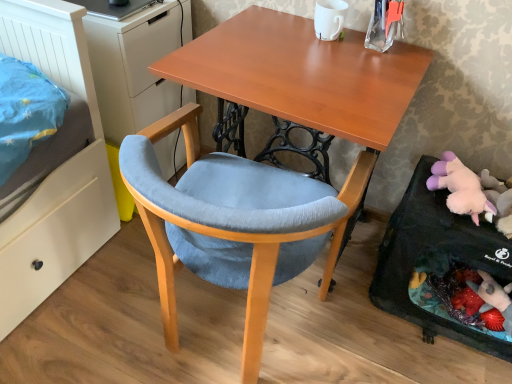
Find the location of a particular element. The image size is (512, 384). free space below velvet blue chair at center (from a real-world perspective) is located at coordinates (223, 331).